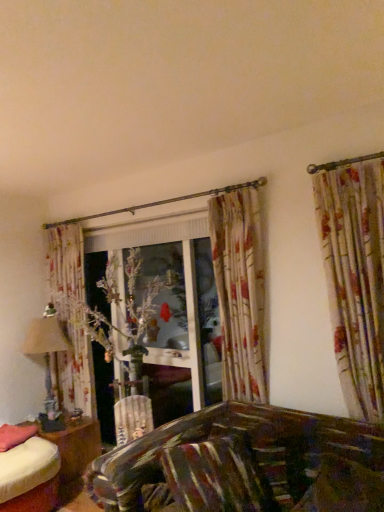
Question: Can you confirm if pink fabric pillow at lower left, positioned as the second pillow in right-to-left order, is taller than matte beige lampshade at left?

Choices:
 (A) no
 (B) yes

Answer: (A)

Question: Is pink fabric pillow at lower left, which is counted as the 1th pillow, starting from the left, looking in the opposite direction of matte beige lampshade at left?

Choices:
 (A) no
 (B) yes

Answer: (A)

Question: Could you tell me if pink fabric pillow at lower left, positioned as the second pillow in right-to-left order, is facing matte beige lampshade at left?

Choices:
 (A) no
 (B) yes

Answer: (A)

Question: From a real-world perspective, is pink fabric pillow at lower left, which is counted as the 1th pillow, starting from the left, physically below matte beige lampshade at left?

Choices:
 (A) no
 (B) yes

Answer: (B)

Question: Is the depth of pink fabric pillow at lower left, which is the 2th pillow in front-to-back order, less than that of matte beige lampshade at left?

Choices:
 (A) yes
 (B) no

Answer: (A)

Question: Considering the relative sizes of pink fabric pillow at lower left, which is counted as the 1th pillow, starting from the left, and matte beige lampshade at left in the image provided, is pink fabric pillow at lower left, which is counted as the 1th pillow, starting from the left, thinner than matte beige lampshade at left?

Choices:
 (A) no
 (B) yes

Answer: (A)

Question: From the image's perspective, does wooden table at lower left appear higher than pink fabric pillow at lower left, positioned as the second pillow in right-to-left order?

Choices:
 (A) no
 (B) yes

Answer: (A)

Question: Is wooden table at lower left turned away from pink fabric pillow at lower left, which is the 2th pillow in front-to-back order?

Choices:
 (A) yes
 (B) no

Answer: (B)

Question: Is the depth of wooden table at lower left less than that of pink fabric pillow at lower left, which is the first pillow in back-to-front order?

Choices:
 (A) no
 (B) yes

Answer: (A)

Question: Is the position of wooden table at lower left more distant than that of pink fabric pillow at lower left, positioned as the second pillow in right-to-left order?

Choices:
 (A) no
 (B) yes

Answer: (B)

Question: Is pink fabric pillow at lower left, positioned as the second pillow in right-to-left order, completely or partially inside wooden table at lower left?

Choices:
 (A) yes
 (B) no

Answer: (B)

Question: Is wooden table at lower left taller than pink fabric pillow at lower left, positioned as the second pillow in right-to-left order?

Choices:
 (A) yes
 (B) no

Answer: (A)

Question: Is wooden table at lower left taller than matte beige lampshade at left?

Choices:
 (A) no
 (B) yes

Answer: (A)